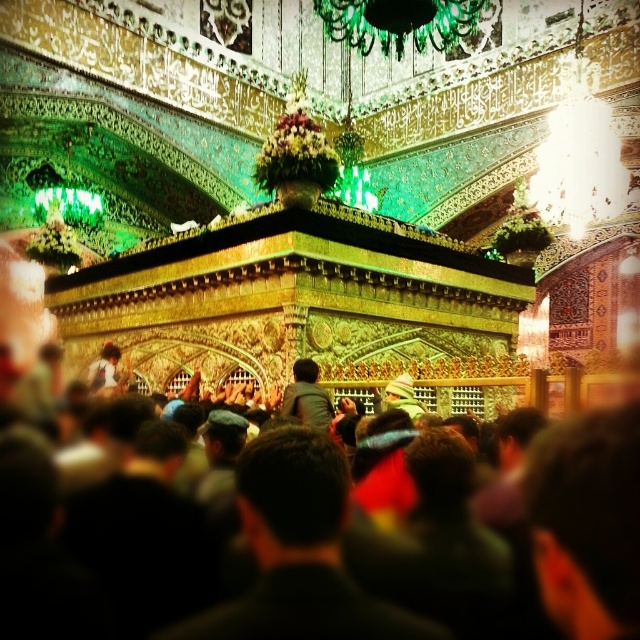
Question: Which point is farther from the camera taking this photo?

Choices:
 (A) (284, 394)
 (B) (557, 422)

Answer: (A)

Question: Does black fabric at center have a lesser width compared to dark gray shirt at center?

Choices:
 (A) yes
 (B) no

Answer: (B)

Question: Is black fabric at center to the left of dark gray shirt at center from the viewer's perspective?

Choices:
 (A) no
 (B) yes

Answer: (A)

Question: Does black fabric at center have a smaller size compared to dark gray shirt at center?

Choices:
 (A) yes
 (B) no

Answer: (B)